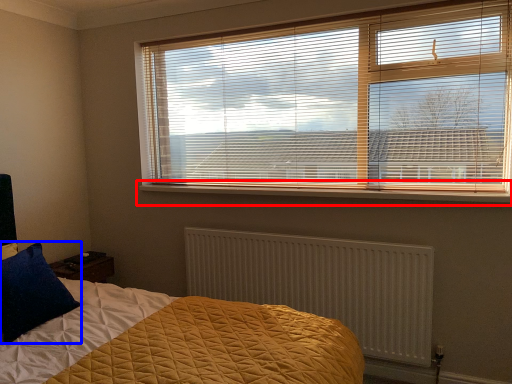
Question: Among these objects, which one is nearest to the camera, window sill (highlighted by a red box) or pillow (highlighted by a blue box)?

Choices:
 (A) window sill
 (B) pillow

Answer: (B)